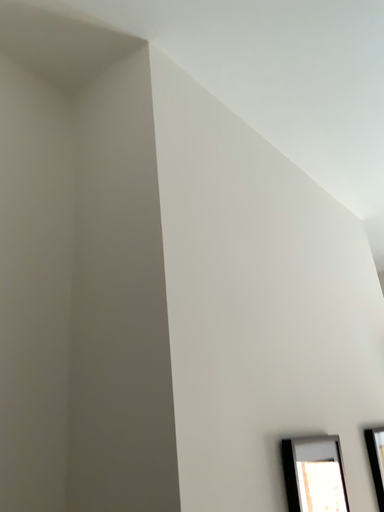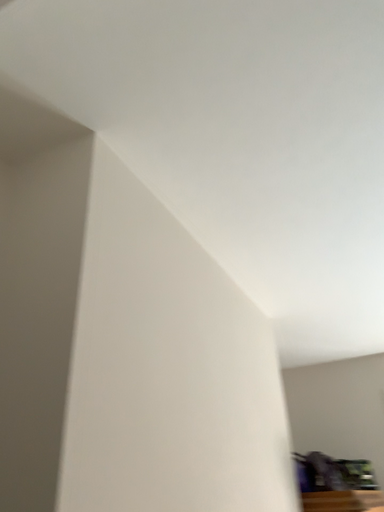
Question: Which way did the camera rotate in the video?

Choices:
 (A) rotated right
 (B) rotated left

Answer: (A)